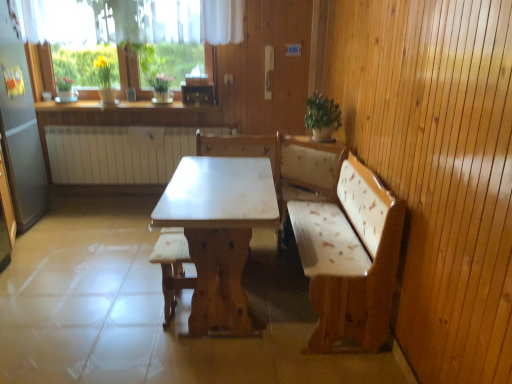
Where is `vacant space to the left of light brown wood table at center`? vacant space to the left of light brown wood table at center is located at coordinates (92, 280).